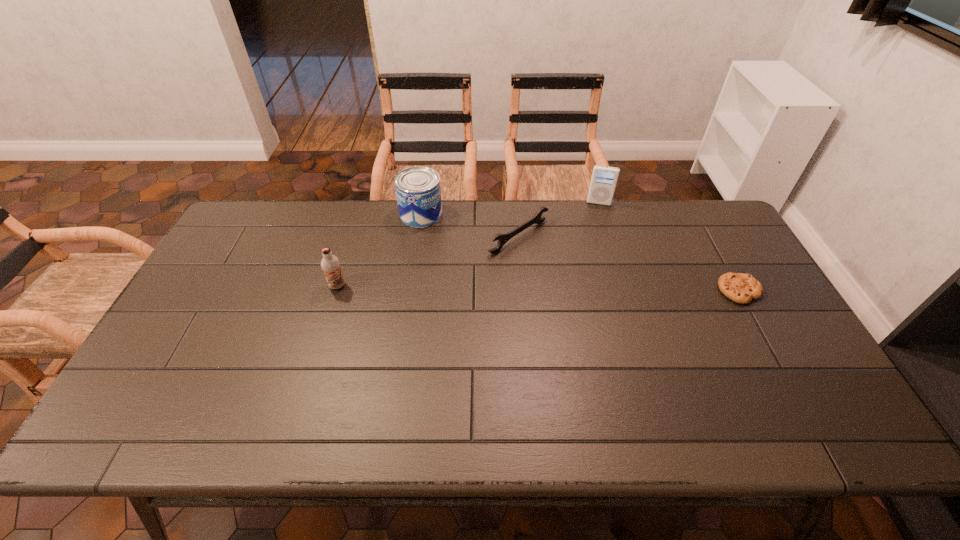
This screenshot has width=960, height=540. I want to click on iPod positioned at the far edge, so click(x=603, y=182).

Where is `object that is at the right edge`? This screenshot has height=540, width=960. object that is at the right edge is located at coordinates (741, 288).

Locate an element on the screen. free location at the far edge of the desktop is located at coordinates (456, 200).

Where is `vacant space at the near edge of the desktop`? vacant space at the near edge of the desktop is located at coordinates (468, 379).

At what (x,y) coordinates should I click in order to perform the action: click on vacant area at the left edge. Please return your answer as a coordinate pair (x, y). Looking at the image, I should click on (249, 271).

I want to click on blank space at the far left corner, so click(x=247, y=229).

You are a GUI agent. You are given a task and a screenshot of the screen. Output one action in this format:
    pyautogui.click(x=<x>, y=<y>)
    Task: Click on the empty location between the fourth object from right to left and the iPod
    The height and width of the screenshot is (540, 960).
    Given the screenshot: What is the action you would take?
    pyautogui.click(x=510, y=208)

Identify the location of vacant area between the shortest object and the wrench. (629, 264).

This screenshot has width=960, height=540. Find the location of `free space between the rightmost object and the fourth object from right to left`. free space between the rightmost object and the fourth object from right to left is located at coordinates (580, 253).

This screenshot has height=540, width=960. I want to click on free spot between the chocolate milk and the rightmost object, so click(539, 288).